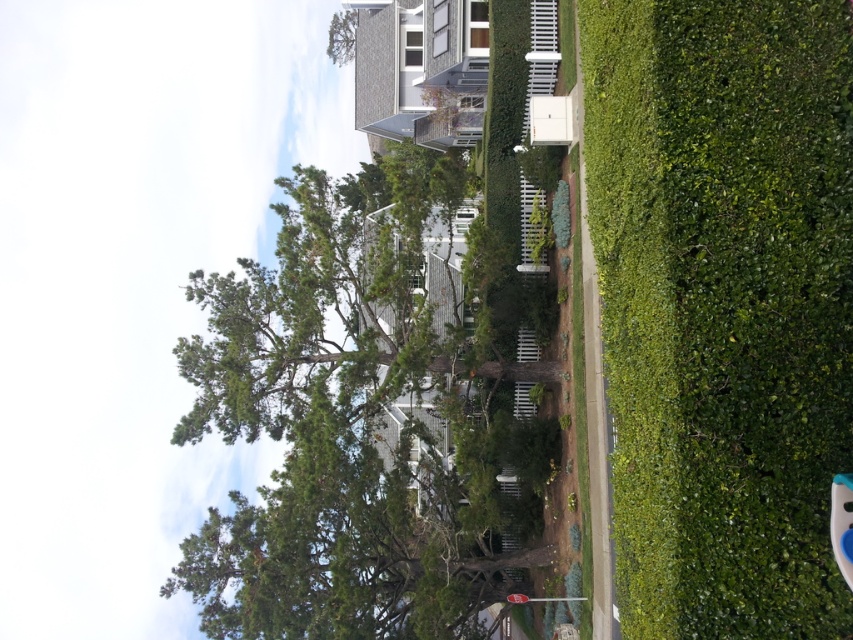
You are standing in a suburban area and see the green leafy tree at upper center. If you want to reach the tree within 10 minutes, what is the minimum average walking speed you need to maintain?

The green leafy tree at upper center is 299.49 feet away from viewer. To cover this distance in 10 minutes, you need to walk at a minimum average speed of approximately 2.99 feet per minute. However, this is a very slow pace, so you might need to adjust your speed depending on obstacles or terrain.

You are standing at the center of the sidewalk in this suburban area. You notice the green leafy hedge at right. Based on its position, can you determine if the hedge is closer to you or further away compared to the large tree on the left?

The green leafy hedge at right is located at point (x=723, y=305), which is further away from the observer compared to the large tree on the left. Therefore, the hedge is further away than the tree.